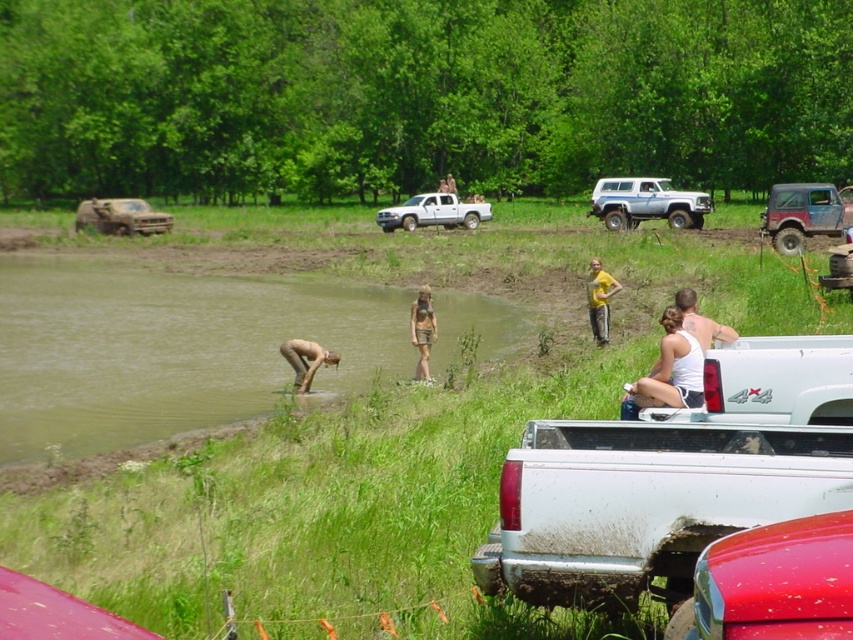
Between silver metallic suv at upper center and brushed metal truck at left, which one is positioned higher?

brushed metal truck at left is higher up.

Measure the distance between silver metallic suv at upper center and brushed metal truck at left.

silver metallic suv at upper center and brushed metal truck at left are 57.13 feet apart from each other.

In order to click on silver metallic suv at upper center in this screenshot , I will do `click(646, 204)`.

Looking at this image, can you confirm if green grass at lower center is wider than white tank top at center?

Indeed, green grass at lower center has a greater width compared to white tank top at center.

Which is above, green grass at lower center or white tank top at center?

green grass at lower center is higher up.

Who is more distant from viewer, [45,400] or [645,378]?

Point [45,400]

Where is `green grass at lower center`? Image resolution: width=853 pixels, height=640 pixels. green grass at lower center is located at coordinates (169, 349).

Where is `yellow fabric pants at center`? yellow fabric pants at center is located at coordinates (599, 300).